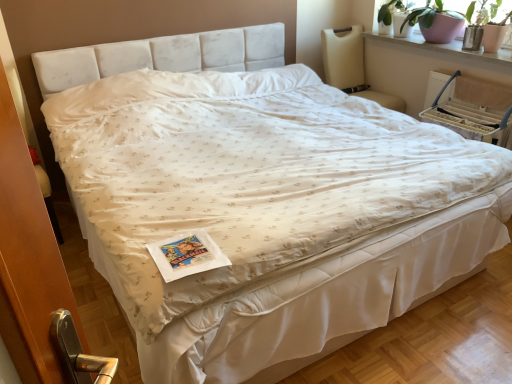
Question: Does beige fabric armchair at upper right have a larger size compared to beige fabric rocking chair at upper right?

Choices:
 (A) no
 (B) yes

Answer: (A)

Question: From the image's perspective, is beige fabric armchair at upper right located beneath beige fabric rocking chair at upper right?

Choices:
 (A) no
 (B) yes

Answer: (B)

Question: From the image's perspective, is beige fabric armchair at upper right located above beige fabric rocking chair at upper right?

Choices:
 (A) yes
 (B) no

Answer: (B)

Question: Considering the relative positions of beige fabric armchair at upper right and beige fabric rocking chair at upper right in the image provided, is beige fabric armchair at upper right to the right of beige fabric rocking chair at upper right from the viewer's perspective?

Choices:
 (A) no
 (B) yes

Answer: (B)

Question: Is beige fabric rocking chair at upper right at the back of beige fabric armchair at upper right?

Choices:
 (A) yes
 (B) no

Answer: (B)

Question: In the image, is matte pink pot at upper right positioned in front of or behind beige fabric armchair at upper right?

Choices:
 (A) front
 (B) behind

Answer: (B)

Question: Choose the correct answer: Is matte pink pot at upper right inside beige fabric armchair at upper right or outside it?

Choices:
 (A) outside
 (B) inside

Answer: (A)

Question: In terms of height, does matte pink pot at upper right look taller or shorter compared to beige fabric armchair at upper right?

Choices:
 (A) short
 (B) tall

Answer: (A)

Question: From the image's perspective, is matte pink pot at upper right above or below beige fabric armchair at upper right?

Choices:
 (A) below
 (B) above

Answer: (B)

Question: Looking at the image, does smooth white window sill at upper right seem bigger or smaller compared to beige fabric rocking chair at upper right?

Choices:
 (A) small
 (B) big

Answer: (A)

Question: From the image's perspective, is smooth white window sill at upper right located above or below beige fabric rocking chair at upper right?

Choices:
 (A) above
 (B) below

Answer: (A)

Question: Based on their positions, is smooth white window sill at upper right located to the left or right of beige fabric rocking chair at upper right?

Choices:
 (A) right
 (B) left

Answer: (A)

Question: Considering the positions of smooth white window sill at upper right and beige fabric rocking chair at upper right in the image, is smooth white window sill at upper right taller or shorter than beige fabric rocking chair at upper right?

Choices:
 (A) tall
 (B) short

Answer: (B)

Question: In terms of size, does beige fabric armchair at upper right appear bigger or smaller than matte pink pot at upper right?

Choices:
 (A) big
 (B) small

Answer: (B)

Question: Is beige fabric armchair at upper right in front of or behind matte pink pot at upper right in the image?

Choices:
 (A) behind
 (B) front

Answer: (B)